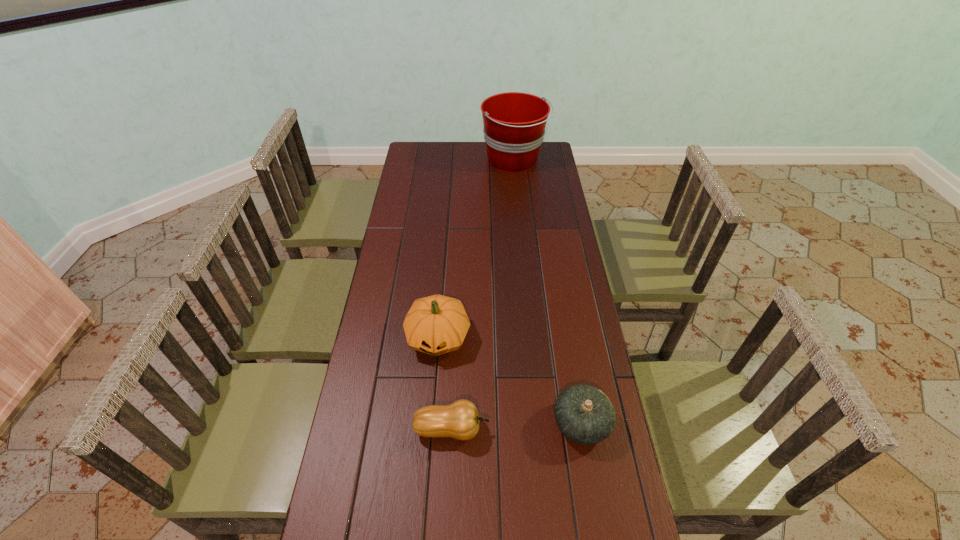
Where is `vacant space situated on the stem side of the shortest gourd`? This screenshot has height=540, width=960. vacant space situated on the stem side of the shortest gourd is located at coordinates (507, 429).

Where is `object that is positioned at the far edge`? object that is positioned at the far edge is located at coordinates (514, 123).

This screenshot has width=960, height=540. I want to click on object located at the left edge, so click(x=437, y=324).

Identify the location of bucket at the right edge. Image resolution: width=960 pixels, height=540 pixels. (514, 123).

You are a GUI agent. You are given a task and a screenshot of the screen. Output one action in this format:
    pyautogui.click(x=<x>, y=<y>)
    Task: Click on the gourd positioned at the right edge
    
    Given the screenshot: What is the action you would take?
    pyautogui.click(x=584, y=414)

Identify the location of object located at the far right corner. (514, 123).

Image resolution: width=960 pixels, height=540 pixels. Find the location of `free space at the far edge of the desktop`. free space at the far edge of the desktop is located at coordinates (444, 155).

This screenshot has width=960, height=540. I want to click on vacant position at the left edge of the desktop, so click(x=426, y=168).

The height and width of the screenshot is (540, 960). In the image, there is a desktop. Find the location of `free space at the right edge`. free space at the right edge is located at coordinates (550, 276).

Locate an element on the screen. The height and width of the screenshot is (540, 960). blank region between the farthest gourd and the rightmost gourd is located at coordinates (510, 380).